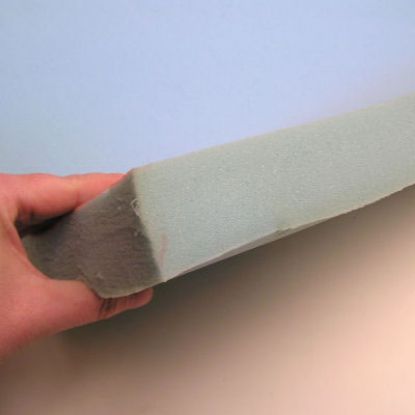
Where is `gray color of soft foam`? gray color of soft foam is located at coordinates (124, 249).